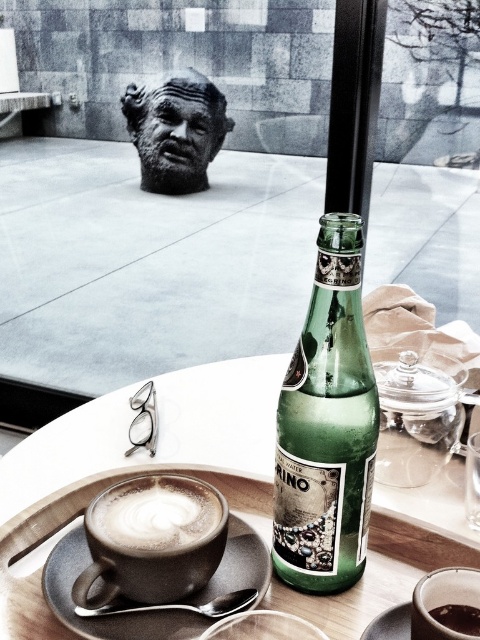
Question: Among these objects, which one is farthest from the camera?

Choices:
 (A) matte ceramic mug at lower center
 (B) matte white tray at center

Answer: (B)

Question: Is matte white tray at center below matte ceramic saucer at lower left?

Choices:
 (A) no
 (B) yes

Answer: (A)

Question: Which point is farther from the camera taking this photo?

Choices:
 (A) (33, 580)
 (B) (120, 636)
 (C) (93, 509)

Answer: (A)

Question: Can you confirm if black stone bust at upper center is thinner than white frothy coffee at center?

Choices:
 (A) no
 (B) yes

Answer: (A)

Question: Estimate the real-world distances between objects in this image. Which object is farther from the black stone bust at upper center?

Choices:
 (A) matte white tray at center
 (B) matte ceramic saucer at lower left

Answer: (B)

Question: Is matte white tray at center smaller than matte ceramic saucer at lower left?

Choices:
 (A) no
 (B) yes

Answer: (A)